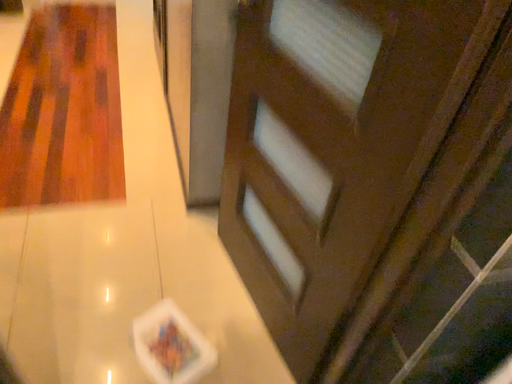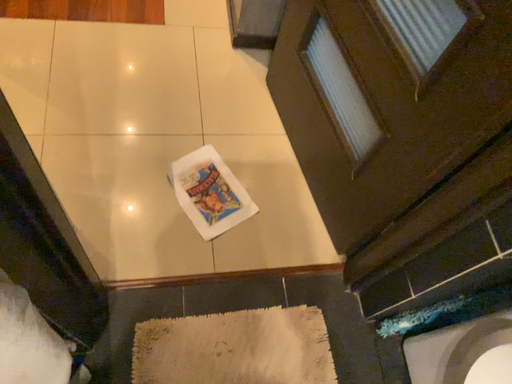
Question: Which way did the camera rotate in the video?

Choices:
 (A) rotated upward
 (B) rotated downward

Answer: (B)